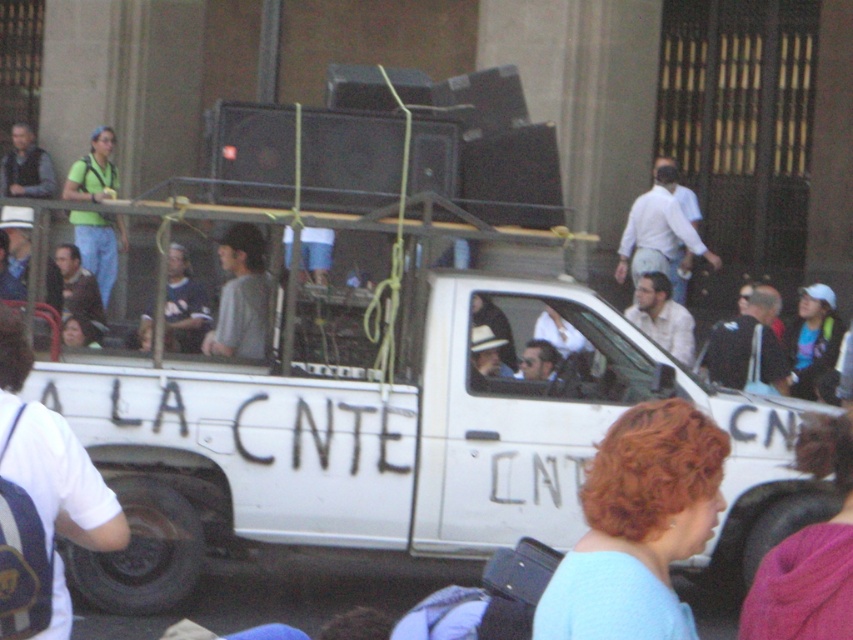
Who is shorter, light blue fabric at center or white shirt at center?

light blue fabric at center is shorter.

Does light blue fabric at center have a greater width compared to white shirt at center?

No.

Which is in front, point (656, 593) or point (669, 252)?

Point (656, 593) is in front.

You are a GUI agent. You are given a task and a screenshot of the screen. Output one action in this format:
    pyautogui.click(x=<x>, y=<y>)
    Task: Click on the light blue fabric at center
    The height and width of the screenshot is (640, 853).
    Given the screenshot: What is the action you would take?
    pyautogui.click(x=637, y=528)

Find the location of a particular element. This screenshot has height=640, width=853. white fabric cap at upper right is located at coordinates (811, 339).

What do you see at coordinates (811, 339) in the screenshot? I see `white fabric cap at upper right` at bounding box center [811, 339].

Which is behind, point (807, 372) or point (177, 328)?

The point (177, 328) is more distant.

Locate an element on the screen. This screenshot has height=640, width=853. white fabric cap at upper right is located at coordinates (811, 339).

Is black leather jacket at center thinner than dark blue shirt at center?

Incorrect, black leather jacket at center's width is not less than dark blue shirt at center's.

Can you confirm if black leather jacket at center is positioned below dark blue shirt at center?

Yes.

Does point (706, 348) lie behind point (173, 262)?

That is False.

This screenshot has width=853, height=640. I want to click on black leather jacket at center, so click(747, 348).